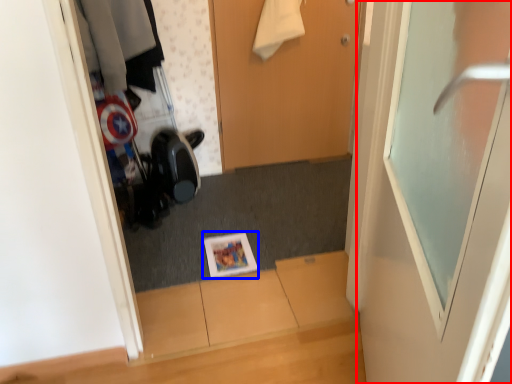
Question: Among these objects, which one is nearest to the camera, door (highlighted by a red box) or magazine (highlighted by a blue box)?

Choices:
 (A) door
 (B) magazine

Answer: (A)